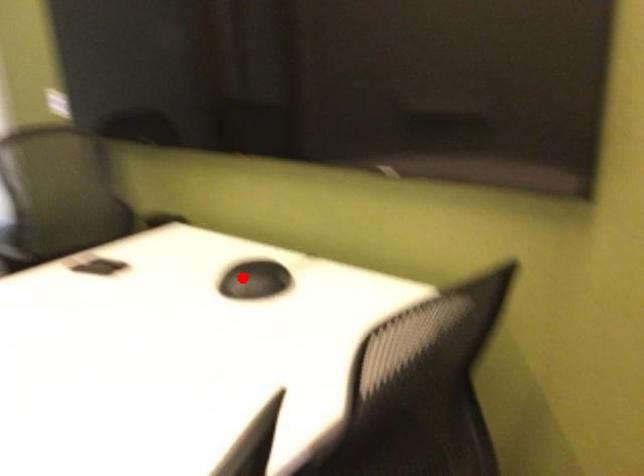
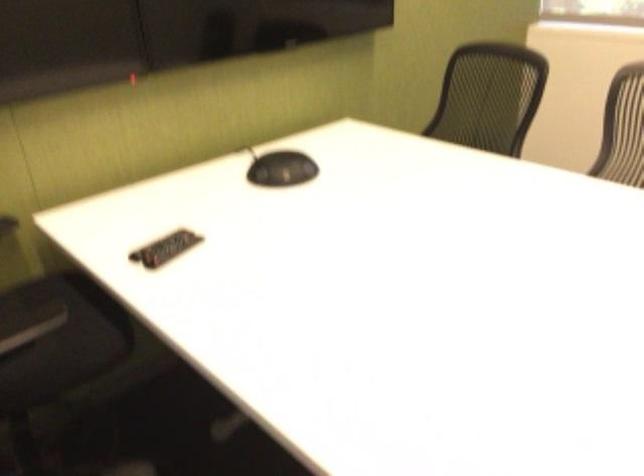
Find the pixel in the second image that matches the highlighted location in the first image.

(281, 169)